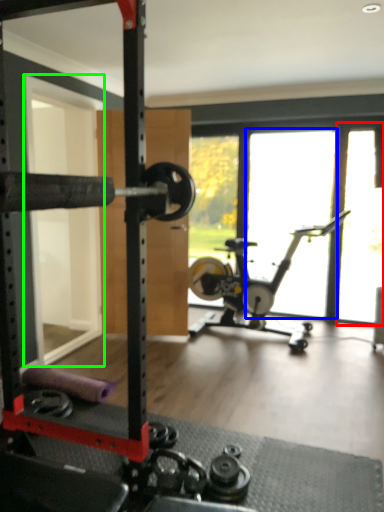
Question: Which object is the closest to the window screen (highlighted by a red box)? Choose among these: window (highlighted by a blue box) or screen door (highlighted by a green box).

Choices:
 (A) window
 (B) screen door

Answer: (A)